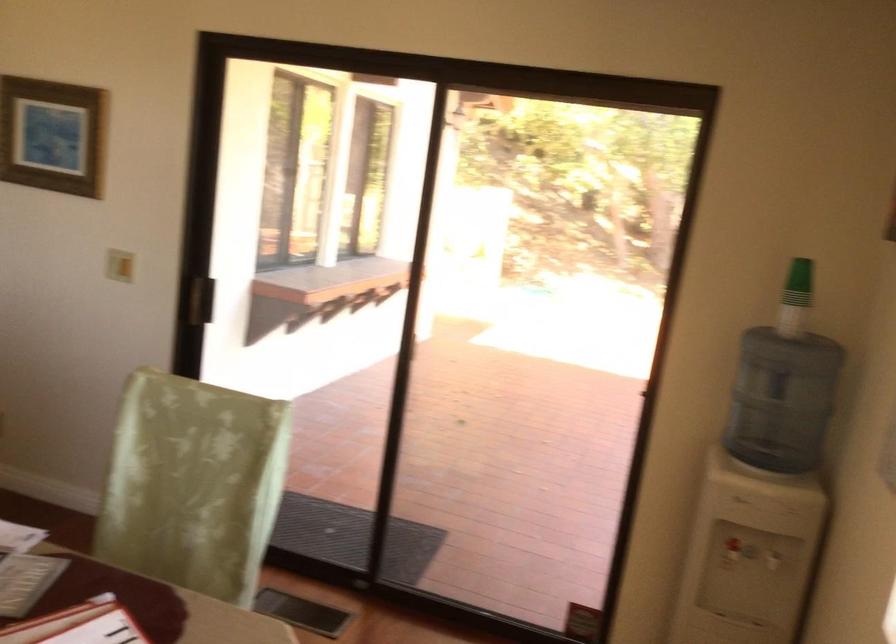
What do you see at coordinates (731, 553) in the screenshot? I see `the red dispenser tap` at bounding box center [731, 553].